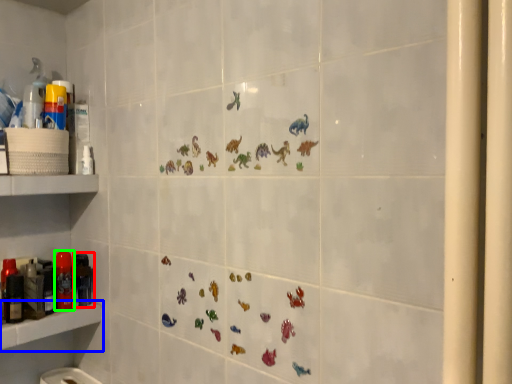
Question: Which object is the farthest from toiletry (highlighted by a red box)? Choose among these: shelf (highlighted by a blue box) or toiletry (highlighted by a green box).

Choices:
 (A) shelf
 (B) toiletry

Answer: (A)